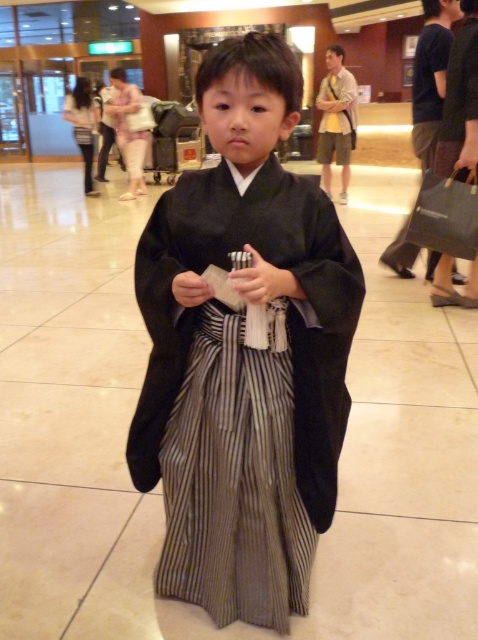
Question: Can you confirm if black silk kimono at center is smaller than striped cotton kimono at center?

Choices:
 (A) no
 (B) yes

Answer: (A)

Question: Among these objects, which one is nearest to the camera?

Choices:
 (A) striped cotton kimono at center
 (B) black silk kimono at center

Answer: (B)

Question: Observing the image, what is the correct spatial positioning of black silk kimono at center in reference to striped cotton kimono at center?

Choices:
 (A) left
 (B) right

Answer: (B)

Question: Which of the following is the farthest from the observer?

Choices:
 (A) (202, 308)
 (B) (260, 452)

Answer: (B)

Question: Is black silk kimono at center positioned before striped cotton kimono at center?

Choices:
 (A) yes
 (B) no

Answer: (A)